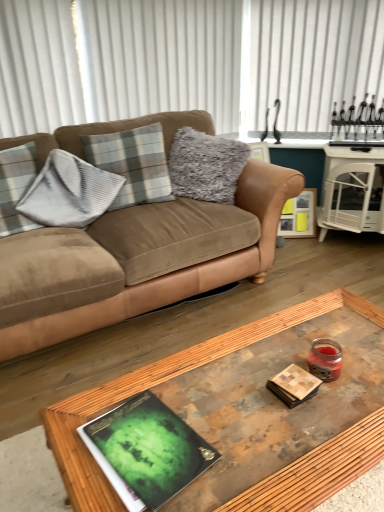
At what (x,y) coordinates should I click in order to perform the action: click on free point behind green matte book at center. Please return your answer as a coordinate pair (x, y). Looking at the image, I should click on (192, 378).